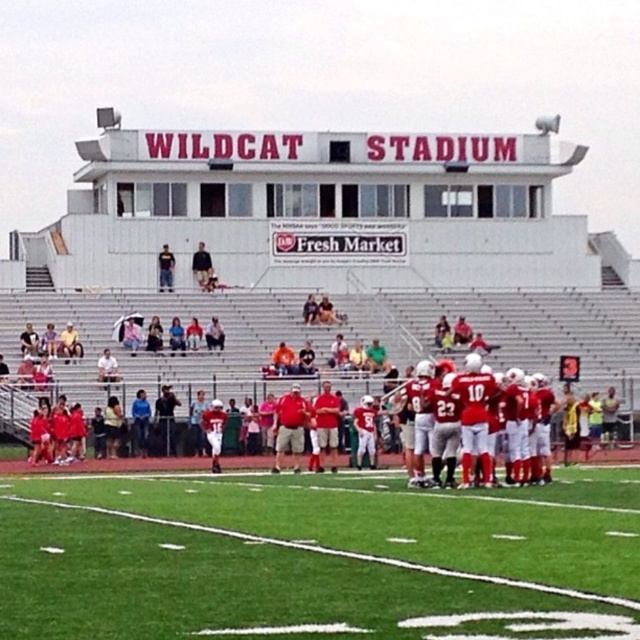
Looking at this image, who is taller, green artificial turf at center or red matte jersey at center?

With more height is red matte jersey at center.

Can you confirm if green artificial turf at center is wider than red matte jersey at center?

Indeed, green artificial turf at center has a greater width compared to red matte jersey at center.

Which is in front, point (608, 572) or point (467, 400)?

Point (608, 572) is in front.

At what (x,y) coordinates should I click in order to perform the action: click on green artificial turf at center. Please return your answer as a coordinate pair (x, y). Looking at the image, I should click on (317, 557).